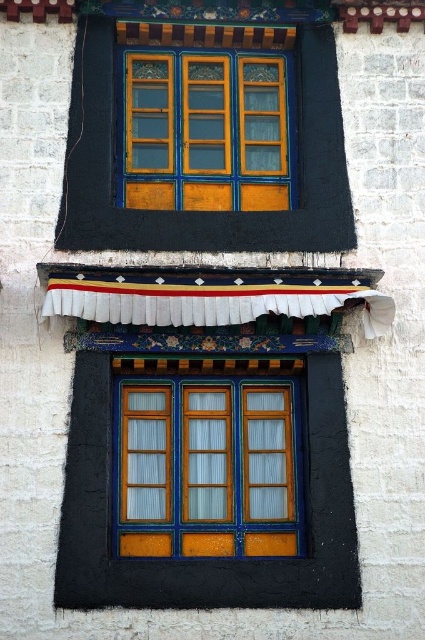
Question: Is matte wooden window at upper center behind wooden at lower center?

Choices:
 (A) no
 (B) yes

Answer: (B)

Question: Can you confirm if matte wood window frame at center is positioned to the right of matte wooden window at upper center?

Choices:
 (A) yes
 (B) no

Answer: (A)

Question: Which object is closer to the camera taking this photo?

Choices:
 (A) wooden at center
 (B) matte wooden window at upper center
 (C) matte wood window frame at center

Answer: (C)

Question: Which point appears closest to the camera in this image?

Choices:
 (A) (283, 422)
 (B) (149, 486)

Answer: (B)

Question: Which object appears closest to the camera in this image?

Choices:
 (A) wooden at lower center
 (B) matte wooden window at upper center
 (C) wooden shutter at center

Answer: (C)

Question: Is the position of matte wood window frame at center more distant than that of wooden at center?

Choices:
 (A) yes
 (B) no

Answer: (B)